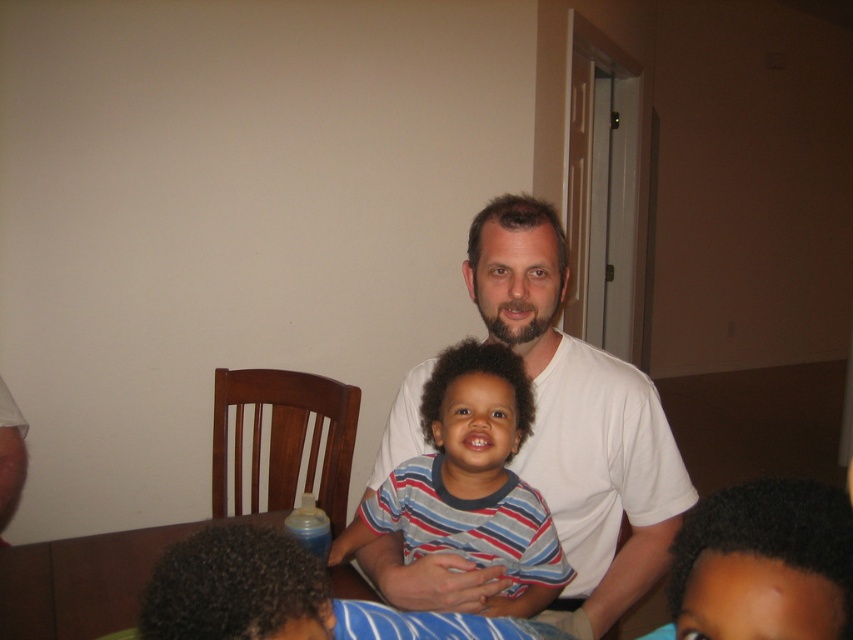
Can you confirm if white smooth shirt at center is positioned above striped cotton shirt at center?

Yes, white smooth shirt at center is above striped cotton shirt at center.

Is white smooth shirt at center to the left of striped cotton shirt at center from the viewer's perspective?

Incorrect, white smooth shirt at center is not on the left side of striped cotton shirt at center.

Is point (392, 428) closer to viewer compared to point (396, 472)?

That is False.

Locate an element on the screen. This screenshot has width=853, height=640. white smooth shirt at center is located at coordinates (578, 419).

Does white smooth shirt at center appear on the right side of brown wooden table at lower center?

Yes, white smooth shirt at center is to the right of brown wooden table at lower center.

Can you confirm if white smooth shirt at center is shorter than brown wooden table at lower center?

In fact, white smooth shirt at center may be taller than brown wooden table at lower center.

Is point (654, 557) more distant than point (137, 570)?

No, (654, 557) is closer to viewer.

Where is `white smooth shirt at center`? This screenshot has height=640, width=853. white smooth shirt at center is located at coordinates (578, 419).

Find the location of a particular element. Image resolution: width=853 pixels, height=640 pixels. striped cotton shirt at center is located at coordinates (469, 483).

How distant is striped cotton shirt at center from brown wooden table at lower center?

They are 13.57 inches apart.

What do you see at coordinates (469, 483) in the screenshot? This screenshot has width=853, height=640. I see `striped cotton shirt at center` at bounding box center [469, 483].

Find the location of a particular element. The height and width of the screenshot is (640, 853). striped cotton shirt at center is located at coordinates tap(469, 483).